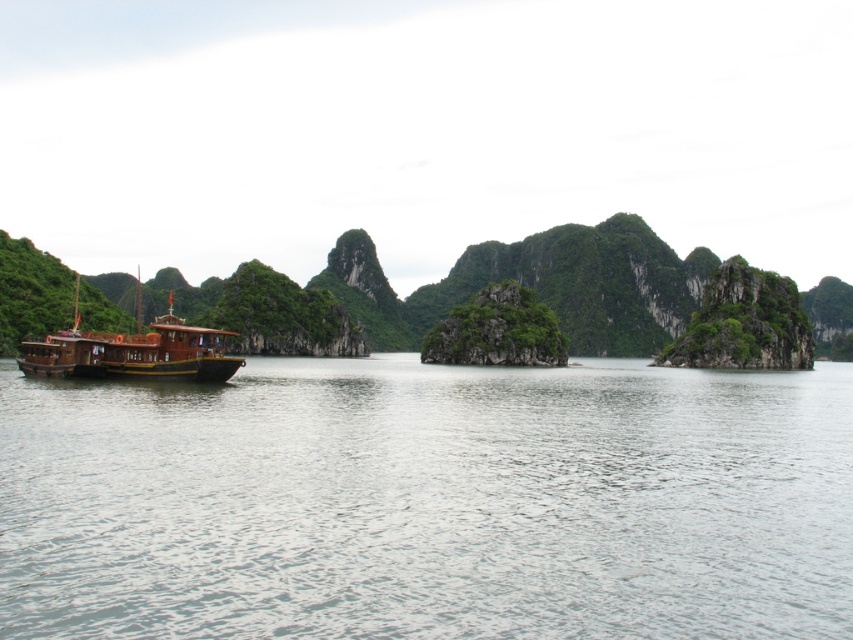
Between clear water at left and wooden boat at left, which one has less height?

Standing shorter between the two is clear water at left.

Which is more to the left, clear water at left or wooden boat at left?

From the viewer's perspective, wooden boat at left appears more on the left side.

Does point (119, 406) lie in front of point (35, 346)?

Yes, it is in front of point (35, 346).

Image resolution: width=853 pixels, height=640 pixels. What are the coordinates of `clear water at left` in the screenshot? It's located at (428, 502).